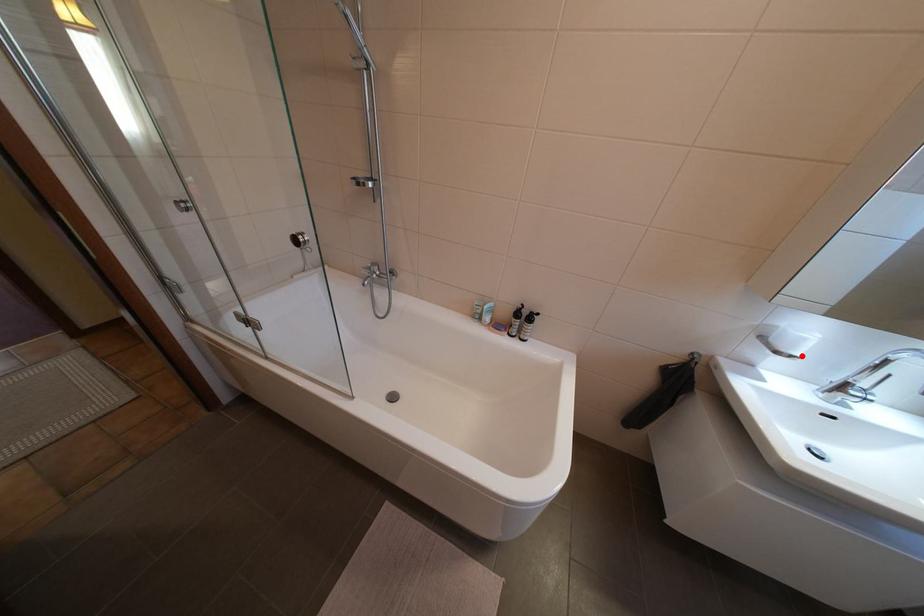
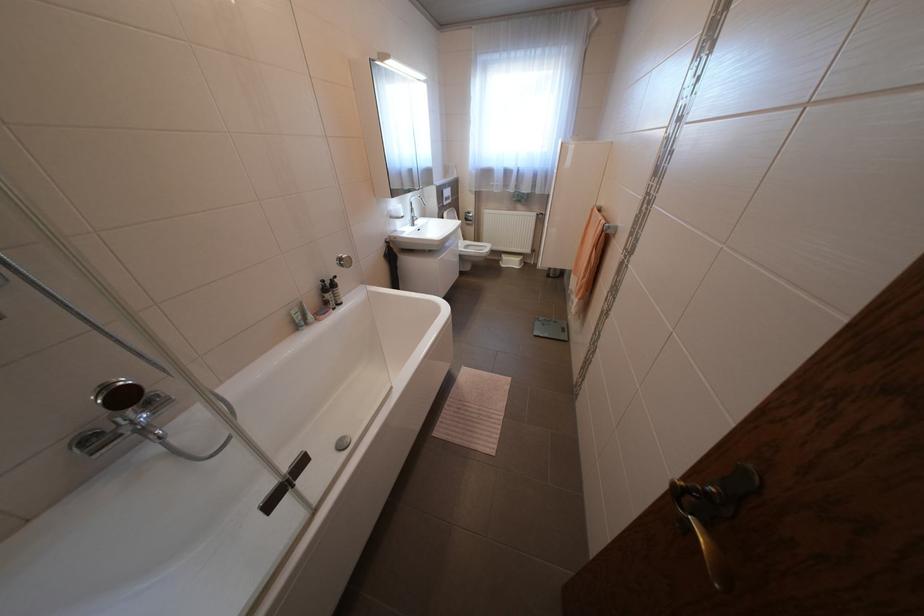
Where in the second image is the point corresponding to the highlighted location from the first image?

(412, 216)